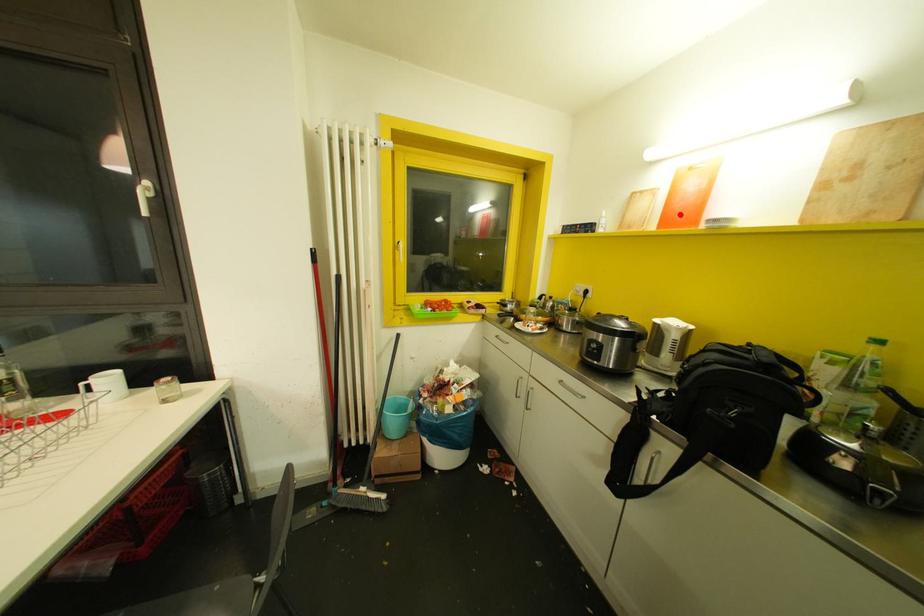
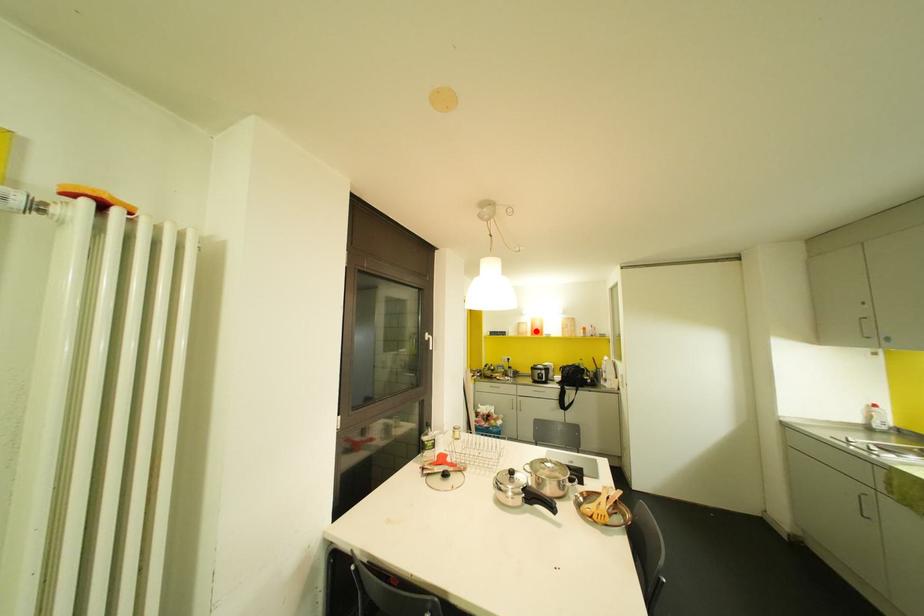
I am providing you with two images of the same scene from different viewpoints. A red point is marked on the first image and another point is marked on the second image. Is the marked point in image1 the same physical position as the marked point in image2?

Yes